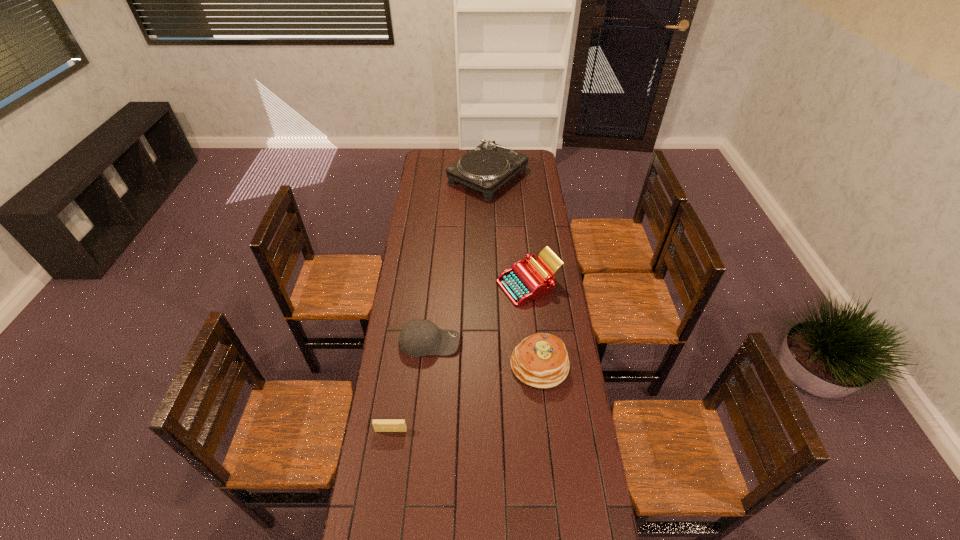
The width and height of the screenshot is (960, 540). Find the location of `vacant space positioned on the front brim of the baseball cap`. vacant space positioned on the front brim of the baseball cap is located at coordinates pyautogui.click(x=506, y=342).

Find the location of a particular element. Image resolution: width=960 pixels, height=540 pixels. blank space located 0.080m on the back of the pancake is located at coordinates (536, 325).

At what (x,y) coordinates should I click in order to perform the action: click on vacant space situated at the front of the nearest object with spools. Please return your answer as a coordinate pair (x, y). Looking at the image, I should click on (388, 453).

At what (x,y) coordinates should I click in order to perform the action: click on object that is at the far edge. Please return your answer as a coordinate pair (x, y). This screenshot has height=540, width=960. Looking at the image, I should click on (487, 167).

The width and height of the screenshot is (960, 540). Find the location of `baseball cap that is positioned at the left edge`. baseball cap that is positioned at the left edge is located at coordinates (418, 337).

The height and width of the screenshot is (540, 960). Identify the location of videotape located at the left edge. (380, 425).

At what (x,y) coordinates should I click in order to perform the action: click on record player that is positioned at the right edge. Please return your answer as a coordinate pair (x, y). This screenshot has height=540, width=960. Looking at the image, I should click on (487, 167).

Locate an element on the screen. typewriter that is at the right edge is located at coordinates (525, 281).

You are a GUI agent. You are given a task and a screenshot of the screen. Output one action in this format:
    pyautogui.click(x=<x>, y=<y>)
    Task: Click on the pancake at the right edge
    
    Given the screenshot: What is the action you would take?
    pyautogui.click(x=541, y=360)

The image size is (960, 540). I want to click on object that is at the far right corner, so pyautogui.click(x=487, y=167).